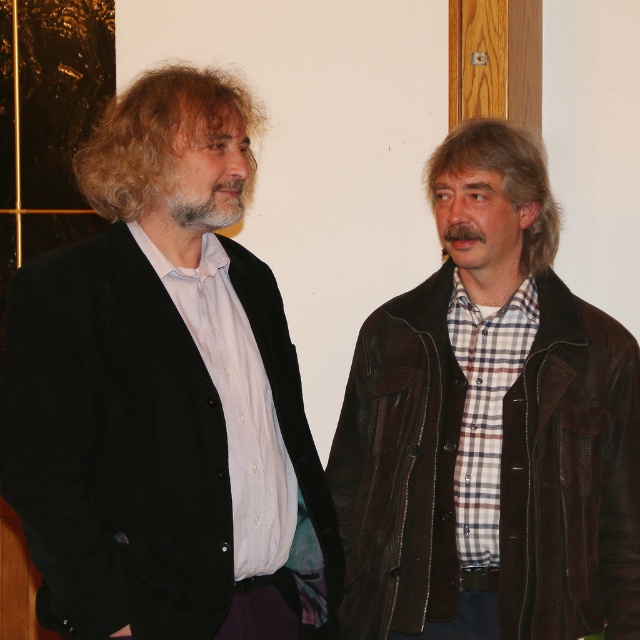
Question: Can you confirm if black velvet jacket at left is thinner than brown leather jacket at right?

Choices:
 (A) no
 (B) yes

Answer: (B)

Question: Can you confirm if black velvet jacket at left is bigger than graywoollybeard at center?

Choices:
 (A) yes
 (B) no

Answer: (A)

Question: Which object is closer to the camera taking this photo?

Choices:
 (A) graywoollybeard at center
 (B) black velvet jacket at left
 (C) brown leather jacket at right

Answer: (B)

Question: Which point is farther to the camera?

Choices:
 (A) (124, 164)
 (B) (488, 291)

Answer: (B)

Question: Which object appears farthest from the camera in this image?

Choices:
 (A) graywoollybeard at center
 (B) brown leather jacket at right

Answer: (B)

Question: Is black velvet jacket at left positioned behind brown leather jacket at right?

Choices:
 (A) yes
 (B) no

Answer: (B)